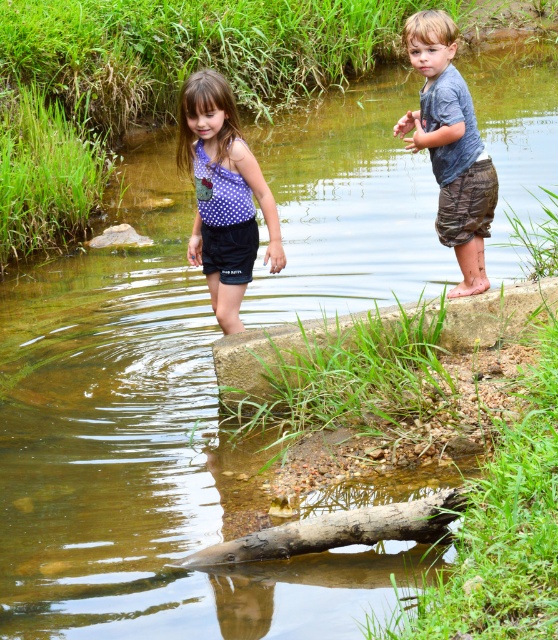
You are a photographer standing at the edge of the stream. You want to capture a closeup shot of the polka dot fabric dress at center. Given that your camera has a maximum zoom range of 5 meters, will you be able to get a clear closeup without moving closer?

The polka dot fabric dress at center is 6.24 meters from the camera, which exceeds the maximum zoom range of 5 meters. Therefore, you will not be able to get a clear closeup without moving closer.

You are a photographer trying to capture a closeup shot of the green grassy stone at center and the polka dot fabric dress at center. Your camera has a maximum focus range of 36 inches. Can you capture both subjects in focus without moving the camera?

The green grassy stone at center is 38.31 inches away from the polka dot fabric dress at center. Since the distance between them exceeds the camera maximum focus range of 36 inches, you cannot capture both subjects in focus without moving the camera.